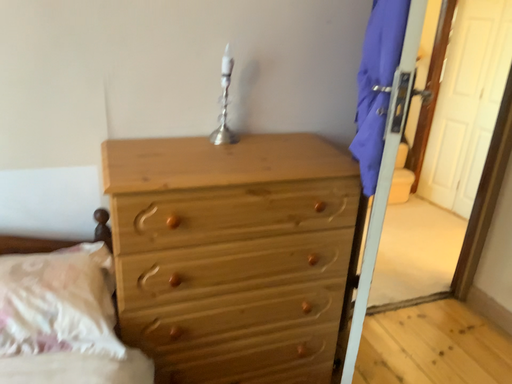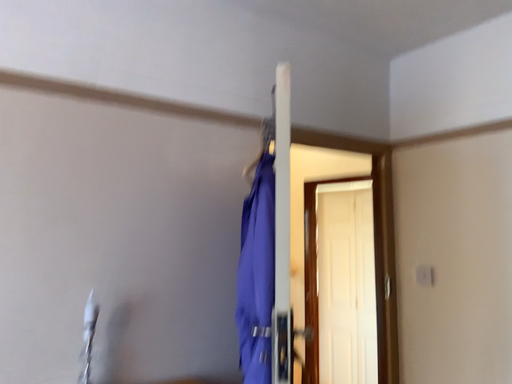
Question: How did the camera likely rotate when shooting the video?

Choices:
 (A) rotated upward
 (B) rotated downward

Answer: (A)